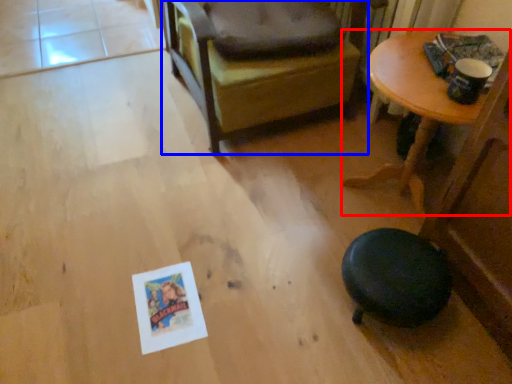
Question: Which of the following is the farthest to the observer, table (highlighted by a red box) or chair (highlighted by a blue box)?

Choices:
 (A) table
 (B) chair

Answer: (B)